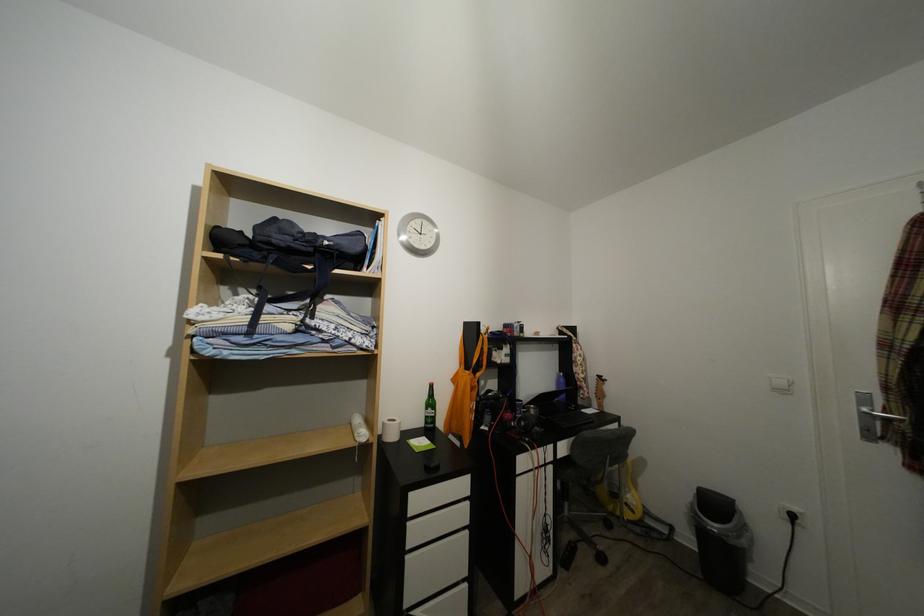
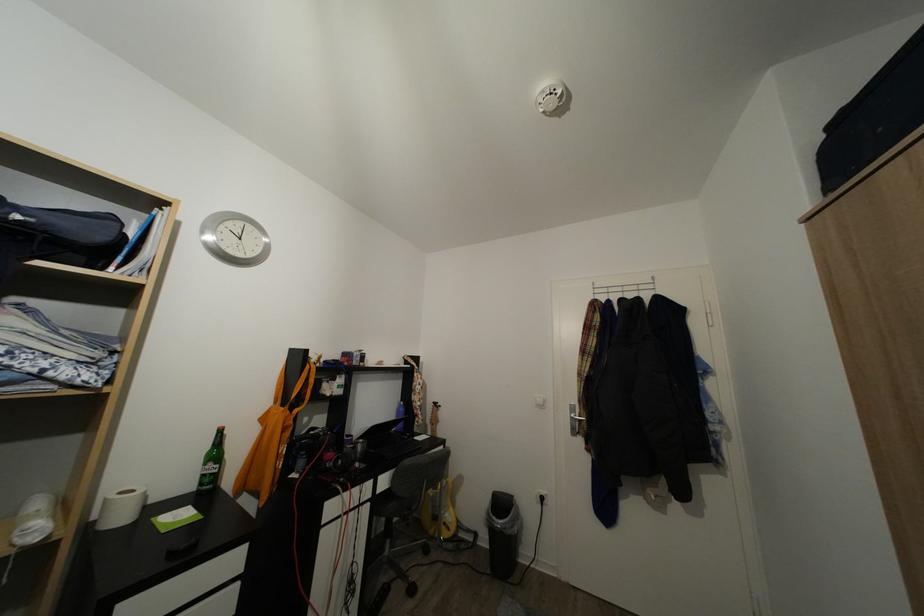
The point at (438, 416) is marked in the first image. Where is the corresponding point in the second image?

(217, 471)